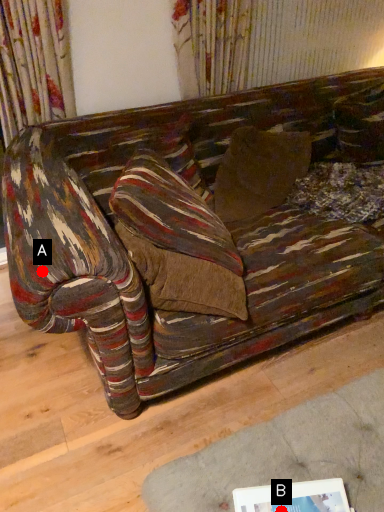
Question: Two points are circled on the image, labeled by A and B beside each circle. Which of the following is the farthest from the observer?

Choices:
 (A) A is further
 (B) B is further

Answer: (A)